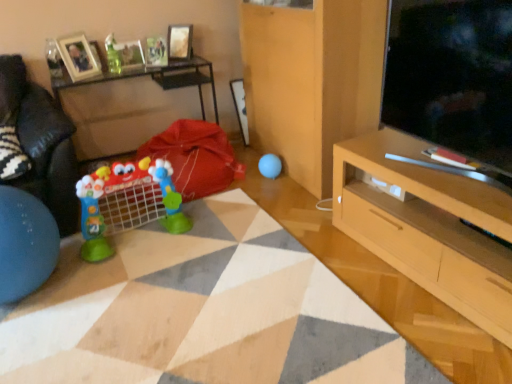
Identify the location of blank area beneath matte black tv at right (from a real-world perspective). The height and width of the screenshot is (384, 512). (447, 170).